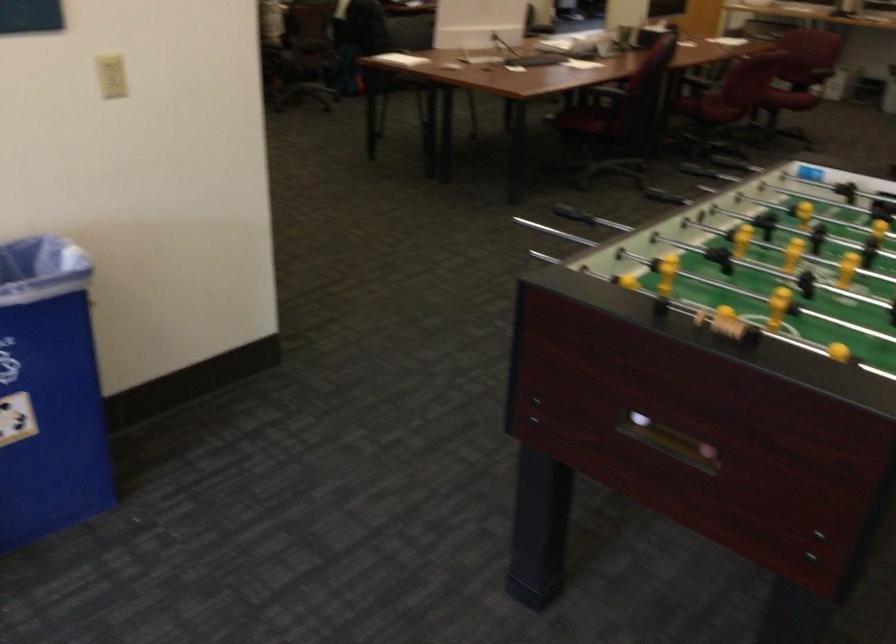
Describe the element at coordinates (110, 76) in the screenshot. This screenshot has width=896, height=644. I see `the light switch` at that location.